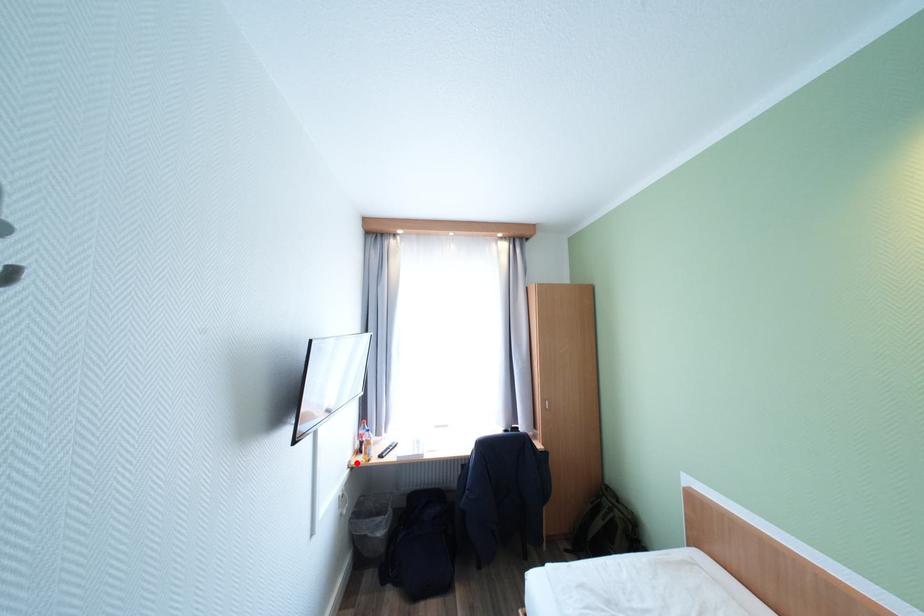
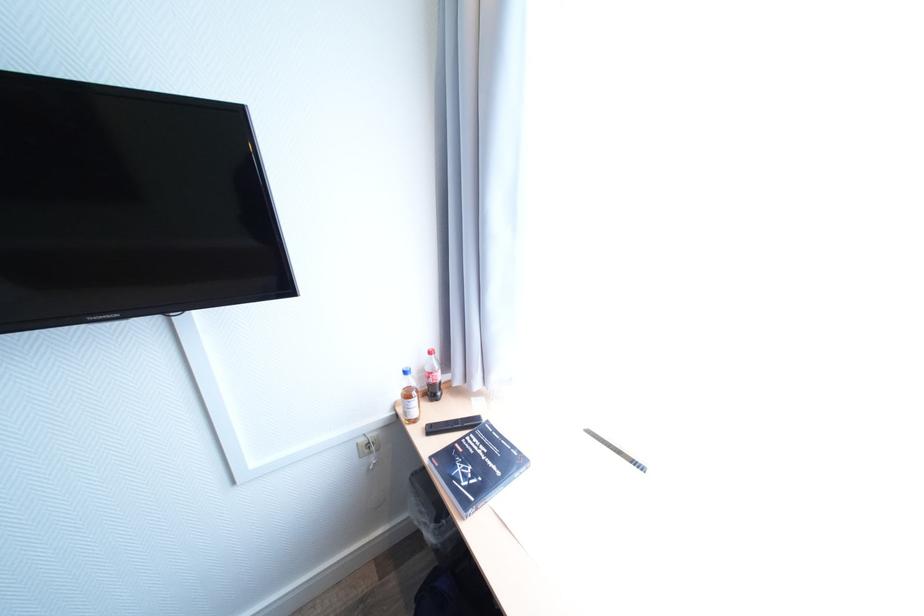
Find the pixel in the second image that matches the highlighted location in the first image.

(403, 403)